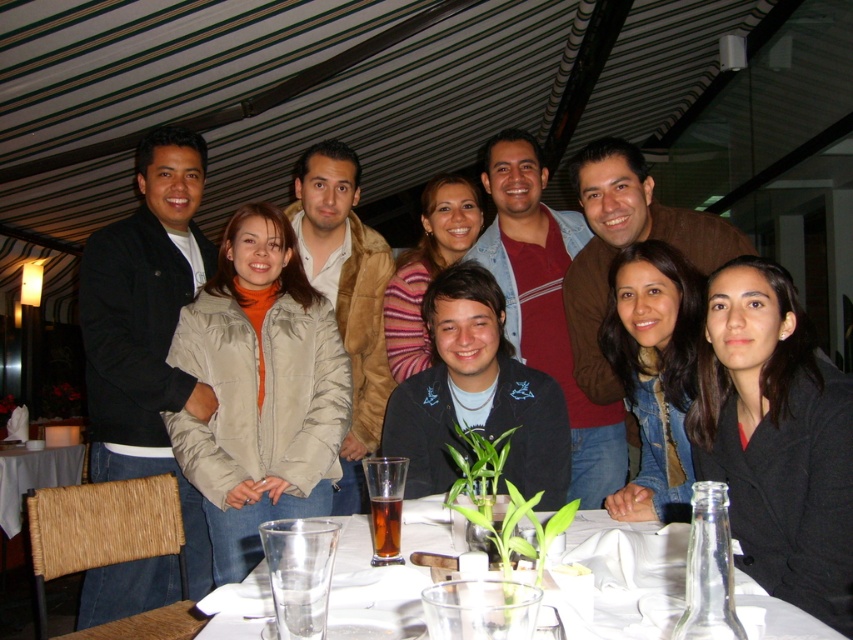
Question: Which of these objects is positioned closest to the white fabric table at lower left?

Choices:
 (A) matte black jacket at left
 (B) clear glass water at lower center

Answer: (A)

Question: Which point is farther to the camera?

Choices:
 (A) (141, 307)
 (B) (405, 582)
 (C) (7, 520)

Answer: (C)

Question: In this image, where is matte black jacket at left located relative to white fabric table at lower left?

Choices:
 (A) left
 (B) right

Answer: (B)

Question: Which object is closer to the camera taking this photo?

Choices:
 (A) matte black jacket at left
 (B) clear glass water at lower center
 (C) white fabric table at lower left

Answer: (B)

Question: Is matte black jacket at left bigger than clear glass water at lower center?

Choices:
 (A) no
 (B) yes

Answer: (B)

Question: Can you confirm if matte black jacket at left is thinner than white fabric table at lower left?

Choices:
 (A) no
 (B) yes

Answer: (A)